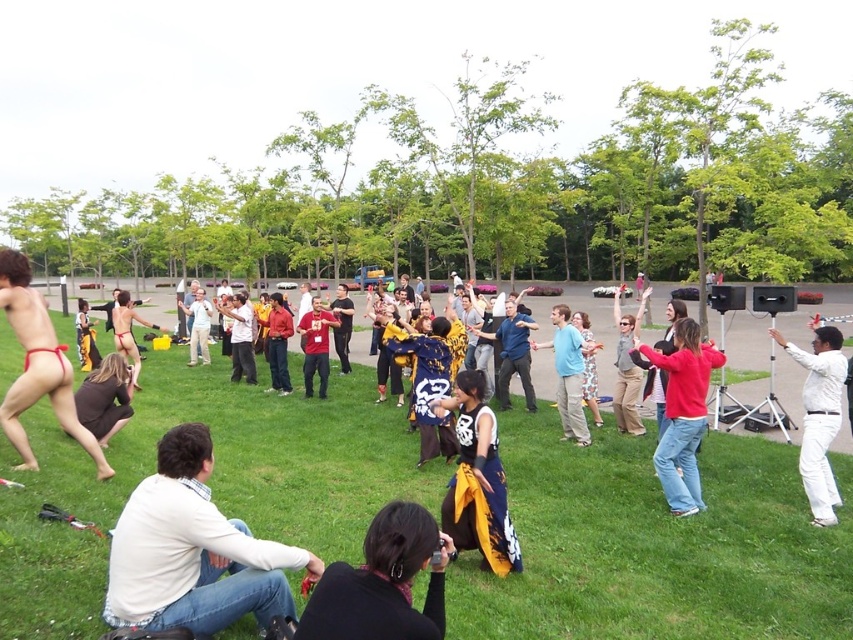
Is green grass at center to the left of black fabric at lower center from the viewer's perspective?

Indeed, green grass at center is positioned on the left side of black fabric at lower center.

Looking at this image, which is more to the right, green grass at center or black fabric at lower center?

Positioned to the right is black fabric at lower center.

Where is `green grass at center`? The height and width of the screenshot is (640, 853). green grass at center is located at coordinates (654, 545).

The width and height of the screenshot is (853, 640). In order to click on green grass at center in this screenshot , I will do 654,545.

Does white matte pants at right appear over blue denim jeans at center?

No, white matte pants at right is not above blue denim jeans at center.

Is white matte pants at right closer to camera compared to blue denim jeans at center?

Yes, white matte pants at right is closer to the viewer.

At what (x,y) coordinates should I click in order to perform the action: click on white matte pants at right. Please return your answer as a coordinate pair (x, y). This screenshot has height=640, width=853. Looking at the image, I should click on (819, 417).

Between black jersey at center and matte red bikini at center, which one appears on the left side from the viewer's perspective?

matte red bikini at center is more to the left.

Which is below, black jersey at center or matte red bikini at center?

black jersey at center is lower down.

Is point (476, 452) positioned in front of point (125, 292)?

Yes, it is.

Identify the location of black jersey at center. [x=477, y=481].